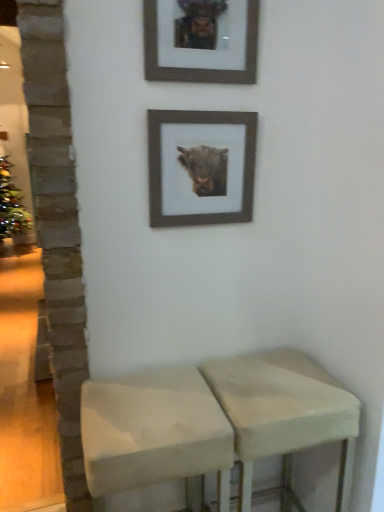
Question: Which direction should I rotate to face white fabric stool at center, which ranks as the 1th stool in left-to-right order, — up or down?

Choices:
 (A) down
 (B) up

Answer: (A)

Question: In which direction should I rotate to look at beige fabric stool at lower center, the second stool from the left?

Choices:
 (A) right
 (B) left

Answer: (A)

Question: From a real-world perspective, is beige fabric stool at lower center, the second stool from the left, beneath wooden picture frame at upper center, positioned as the second picture frame in bottom-to-top order?

Choices:
 (A) no
 (B) yes

Answer: (B)

Question: Does beige fabric stool at lower center, the second stool from the left, have a lesser height compared to wooden picture frame at upper center, positioned as the second picture frame in bottom-to-top order?

Choices:
 (A) yes
 (B) no

Answer: (B)

Question: Is beige fabric stool at lower center, the second stool from the left, facing towards wooden picture frame at upper center, positioned as the second picture frame in bottom-to-top order?

Choices:
 (A) yes
 (B) no

Answer: (B)

Question: From a real-world perspective, is beige fabric stool at lower center, the second stool from the left, located higher than wooden picture frame at upper center, positioned as the second picture frame in bottom-to-top order?

Choices:
 (A) no
 (B) yes

Answer: (A)

Question: Considering the relative sizes of beige fabric stool at lower center, which appears as the first stool when viewed from the right, and wooden picture frame at upper center, positioned as the second picture frame in bottom-to-top order, in the image provided, is beige fabric stool at lower center, which appears as the first stool when viewed from the right, wider than wooden picture frame at upper center, positioned as the second picture frame in bottom-to-top order,?

Choices:
 (A) yes
 (B) no

Answer: (A)

Question: Considering the relative sizes of beige fabric stool at lower center, the second stool from the left, and wooden picture frame at upper center, acting as the first picture frame starting from the top, in the image provided, is beige fabric stool at lower center, the second stool from the left, taller than wooden picture frame at upper center, acting as the first picture frame starting from the top,?

Choices:
 (A) no
 (B) yes

Answer: (B)

Question: Can you confirm if white fabric stool at center, positioned as the second stool in right-to-left order, is positioned to the right of beige fabric stool at lower center, which appears as the first stool when viewed from the right?

Choices:
 (A) no
 (B) yes

Answer: (A)

Question: Is white fabric stool at center, positioned as the second stool in right-to-left order, further to camera compared to beige fabric stool at lower center, which appears as the first stool when viewed from the right?

Choices:
 (A) yes
 (B) no

Answer: (B)

Question: Is white fabric stool at center, positioned as the second stool in right-to-left order, thinner than beige fabric stool at lower center, the second stool from the left?

Choices:
 (A) no
 (B) yes

Answer: (A)

Question: From the image's perspective, is white fabric stool at center, which ranks as the 1th stool in left-to-right order, located above beige fabric stool at lower center, which appears as the first stool when viewed from the right?

Choices:
 (A) no
 (B) yes

Answer: (B)

Question: From a real-world perspective, is white fabric stool at center, which ranks as the 1th stool in left-to-right order, located beneath beige fabric stool at lower center, which appears as the first stool when viewed from the right?

Choices:
 (A) yes
 (B) no

Answer: (B)

Question: Considering the relative sizes of white fabric stool at center, positioned as the second stool in right-to-left order, and beige fabric stool at lower center, the second stool from the left, in the image provided, is white fabric stool at center, positioned as the second stool in right-to-left order, taller than beige fabric stool at lower center, the second stool from the left,?

Choices:
 (A) yes
 (B) no

Answer: (B)

Question: From a real-world perspective, does wooden frame at upper center, placed as the 1th picture frame when sorted from bottom to top, stand above white fabric stool at center, which ranks as the 1th stool in left-to-right order?

Choices:
 (A) no
 (B) yes

Answer: (B)